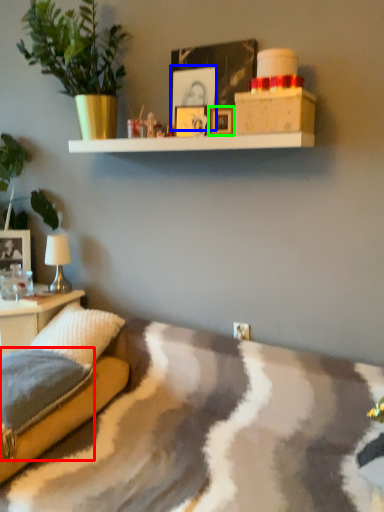
Question: Estimate the real-world distances between objects in this image. Which object is closer to pillow (highlighted by a red box), picture frame (highlighted by a blue box) or picture frame (highlighted by a green box)?

Choices:
 (A) picture frame
 (B) picture frame

Answer: (B)